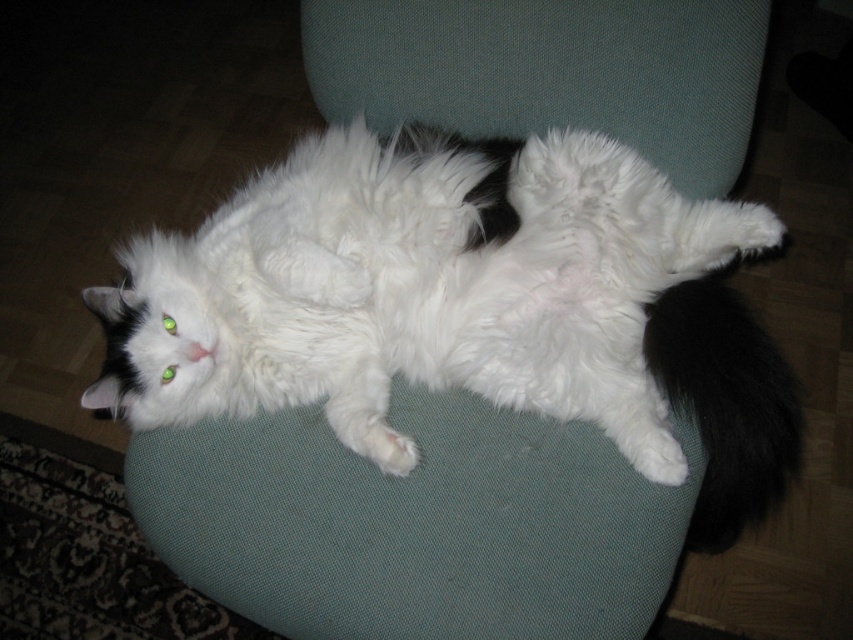
Looking at this image, you are a photographer trying to capture the white fluffy cat at center and the white fluffy cushion at center in a single shot. Given that the camera has a fixed focal length, will the cat take up more space in the photo compared to the cushion?

The white fluffy cat at center is larger in size than the white fluffy cushion at center, so yes, the cat will take up more space in the photo than the cushion.

You are standing in front of the image of a fluffy white cat on a teal cushion. You notice two points marked in the scene. Which of the two points, point (x=567, y=163) or point (x=514, y=83), is closer to you?

Point (x=567, y=163) is closer to the viewer than point (x=514, y=83).